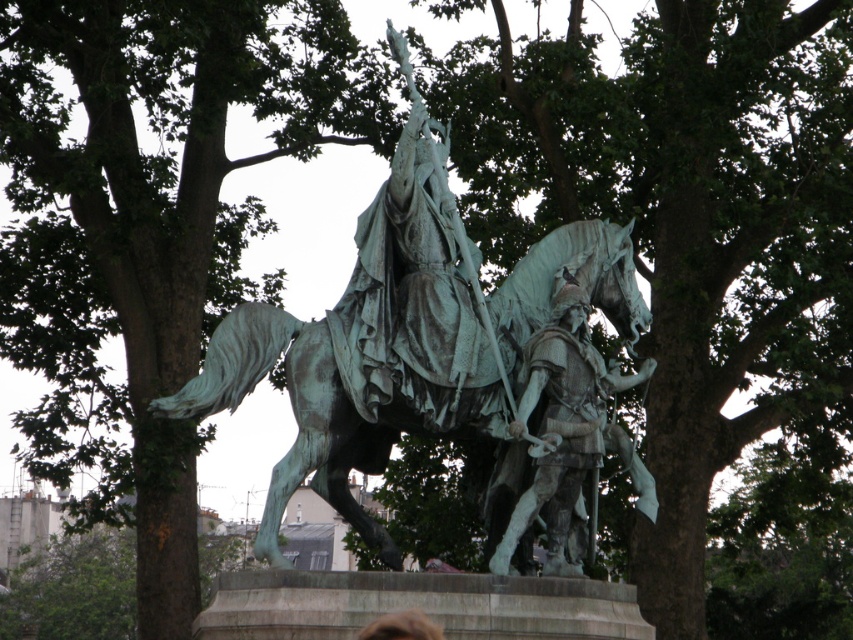
Does green patina statue at center come behind bronze armor at center?

Yes, it is.

Is green patina statue at center closer to the viewer compared to bronze armor at center?

No.

I want to click on green patina statue at center, so click(x=440, y=356).

Is green textured bark at upper left to the right of bronze armor at center from the viewer's perspective?

No, green textured bark at upper left is not to the right of bronze armor at center.

Is point (138, 225) positioned after point (529, 440)?

Yes, it is behind point (529, 440).

This screenshot has height=640, width=853. What do you see at coordinates (151, 224) in the screenshot?
I see `green textured bark at upper left` at bounding box center [151, 224].

At what (x,y) coordinates should I click in order to perform the action: click on green textured bark at upper left. Please return your answer as a coordinate pair (x, y). This screenshot has width=853, height=640. Looking at the image, I should click on (151, 224).

Does green textured bark at upper left appear under green patina statue at center?

No, green textured bark at upper left is not below green patina statue at center.

Between green textured bark at upper left and green patina statue at center, which one appears on the left side from the viewer's perspective?

green textured bark at upper left is more to the left.

Is point (93, 58) positioned behind point (575, 284)?

Yes, point (93, 58) is behind point (575, 284).

Locate an element on the screen. The image size is (853, 640). green textured bark at upper left is located at coordinates (151, 224).